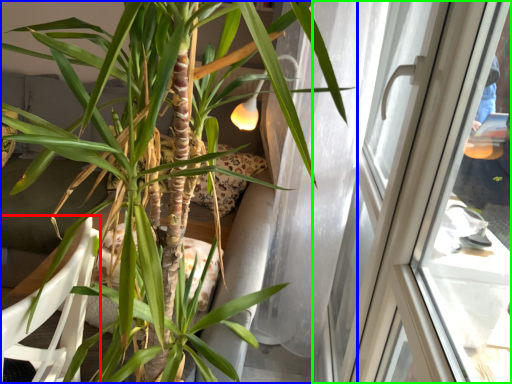
Question: Which object is the closest to the armchair (highlighted by a red box)? Choose among these: houseplant (highlighted by a blue box) or window (highlighted by a green box).

Choices:
 (A) houseplant
 (B) window

Answer: (A)